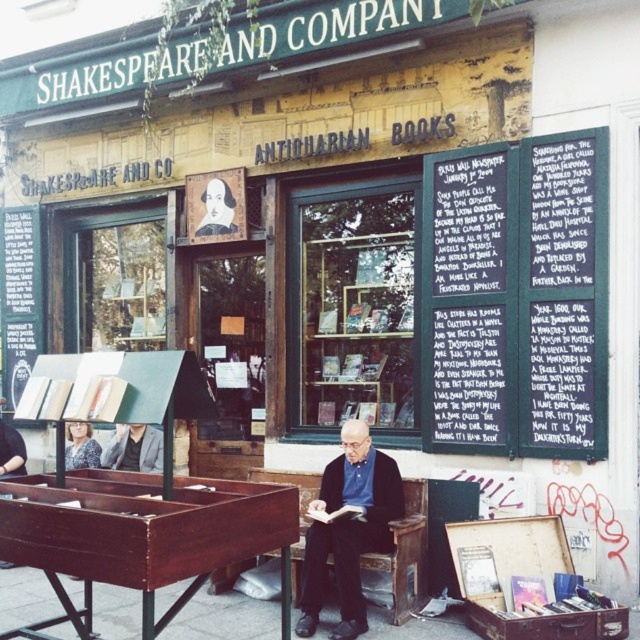
Question: Which point is farther to the camera?

Choices:
 (A) (330, 534)
 (B) (600, 266)

Answer: (B)

Question: Is black chalkboard at upper center above dark blue shirt at center?

Choices:
 (A) yes
 (B) no

Answer: (A)

Question: Is black chalkboard at upper center bigger than dark blue shirt at center?

Choices:
 (A) no
 (B) yes

Answer: (B)

Question: Which point is farther from the camera taking this photo?

Choices:
 (A) [340, 429]
 (B) [442, 321]

Answer: (A)

Question: Among these points, which one is nearest to the camera?

Choices:
 (A) (550, 381)
 (B) (396, 497)

Answer: (B)

Question: Is black chalkboard at upper center bigger than dark blue shirt at center?

Choices:
 (A) yes
 (B) no

Answer: (A)